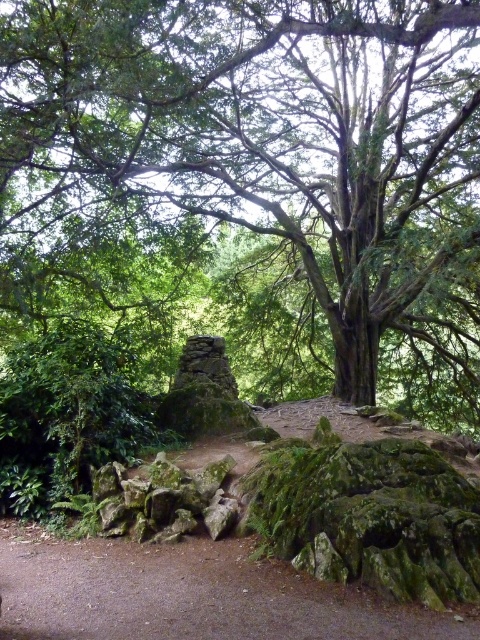
You are standing on the dirt path in the scene and want to walk towards the point labeled as point (240,605). As you move forward, will the point labeled point (351,236) become closer or farther away from you?

The point labeled point (351,236) is further to the viewer than point (240,605). So as you walk towards point (240,605), the point (351,236) will become farther away from you.

You are standing at the point marked as point (274, 140) in the image. Looking around, you see the green leafy tree at center. Which direction should you walk to reach the green leafy tree at center?

Since the green leafy tree at center is located at point (274, 140), which is your current position, you are already at the green leafy tree at center. There is no need to walk in any direction.

You are a hiker walking along the brown dirt path at center and want to reach the green leafy tree at center. Which direction should you turn to head towards the tree?

The green leafy tree at center is to the right of the brown dirt path at center, so you should turn right to head towards the tree.